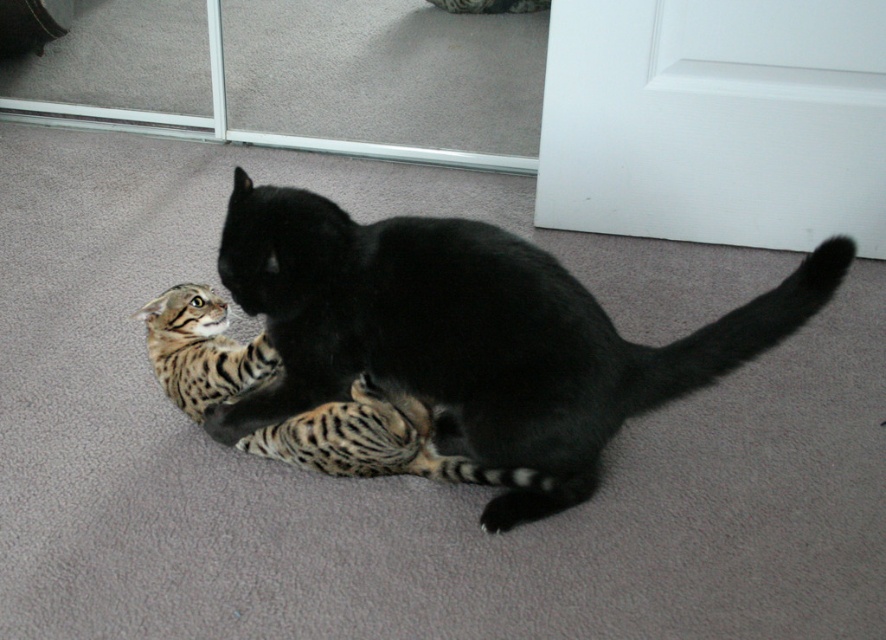
You are a pet owner observing the cats. The black glossy cat at center is on top of the striped fur paw at lower center. Which cat is likely the dominant one in this interaction?

The black glossy cat at center is positioned over striped fur paw at lower center, indicating it is the dominant one in this interaction.

You are a cat owner trying to separate two cats during play. You see the black glossy cat at center and the striped fur paw at lower center. Which one is taller?

The black glossy cat at center is taller than the striped fur paw at lower center.

You are a pet sitter observing the cats in the image. You need to place a small treat bowl between the black glossy cat at center and the tabby fur kitten at lower left. Based on their positions, which cat is closer to the spot where the bowl will be placed?

The tabby fur kitten at lower left is closer to the spot where the treat bowl will be placed because the black glossy cat at center is positioned on top of it, meaning the kitten is lower in position and the bowl would be placed between them, closer to the kitten.